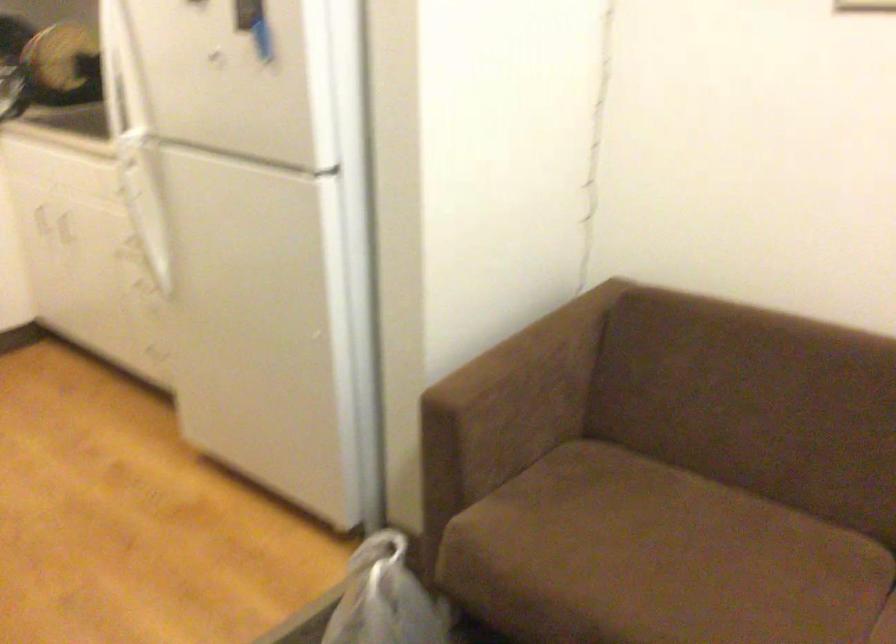
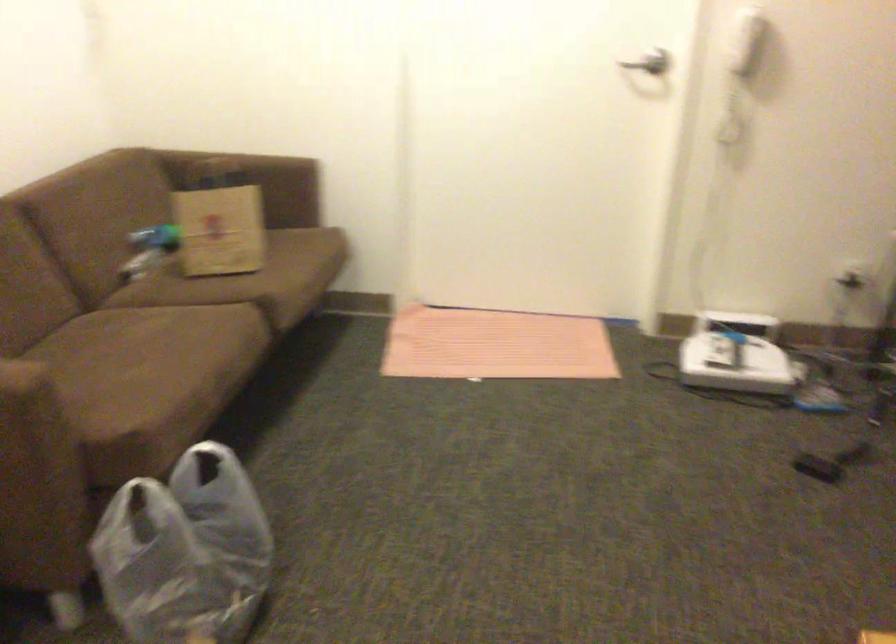
The point at (558,535) is marked in the first image. Where is the corresponding point in the second image?

(110, 402)